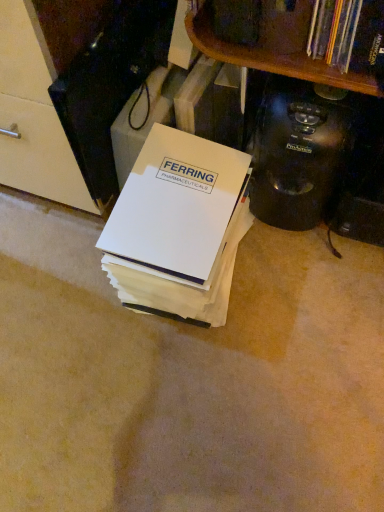
Find the location of a particular element. free region under black plastic coffee maker at right (from a real-world perspective) is located at coordinates (277, 231).